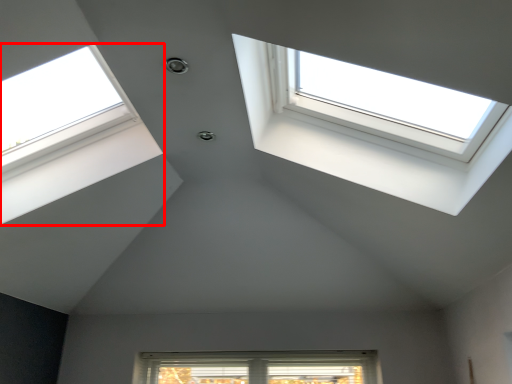
Question: From the image's perspective, what is the correct spatial relationship of window (annotated by the red box) in relation to window?

Choices:
 (A) above
 (B) below

Answer: (B)